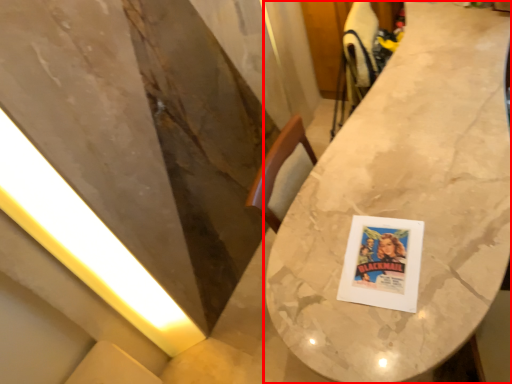
Question: In this image, where is table (annotated by the red box) located relative to light?

Choices:
 (A) left
 (B) right

Answer: (B)